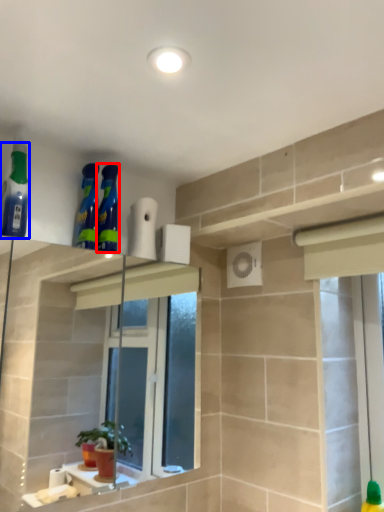
Question: Which point is closer to the camera, cleaning product (highlighted by a red box) or cleaning product (highlighted by a blue box)?

Choices:
 (A) cleaning product
 (B) cleaning product

Answer: (B)